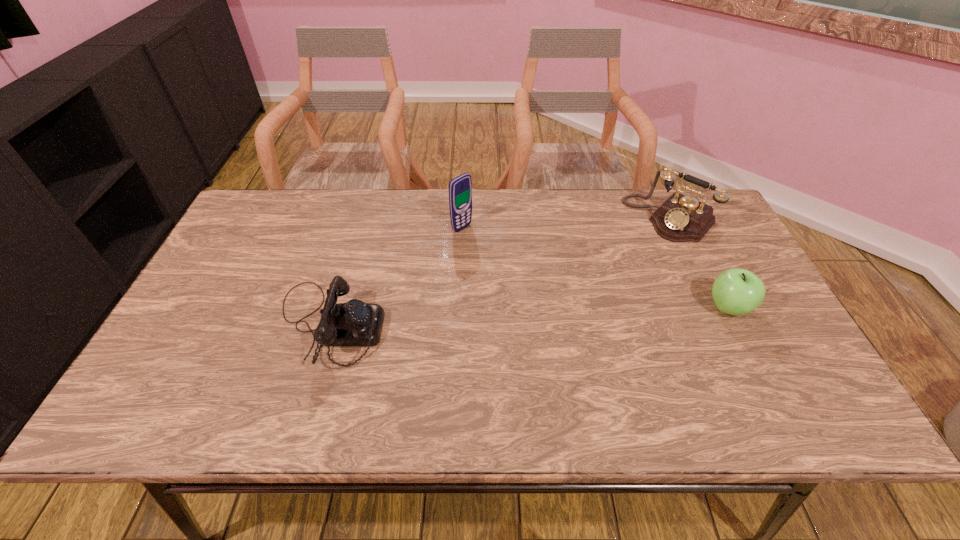
Find the location of `vacant space located 0.250m on the front-facing side of the cellular telephone`. vacant space located 0.250m on the front-facing side of the cellular telephone is located at coordinates (532, 275).

Where is `vacant area situated 0.220m on the dial of the taller telephone`? The width and height of the screenshot is (960, 540). vacant area situated 0.220m on the dial of the taller telephone is located at coordinates (610, 275).

Image resolution: width=960 pixels, height=540 pixels. Identify the location of vacant space located 0.090m on the dial of the taller telephone. (634, 251).

Identify the location of vacant space located 0.270m on the dial of the taller telephone. This screenshot has height=540, width=960. (600, 285).

The image size is (960, 540). I want to click on cellular telephone present at the far edge, so click(460, 188).

Locate an element on the screen. This screenshot has height=540, width=960. telephone at the far edge is located at coordinates (680, 218).

Locate an element on the screen. object positioned at the near edge is located at coordinates (354, 323).

The image size is (960, 540). Identify the location of apple positioned at the right edge. (736, 291).

The width and height of the screenshot is (960, 540). Find the location of `telephone positioned at the right edge`. telephone positioned at the right edge is located at coordinates (680, 218).

This screenshot has width=960, height=540. Find the location of `object located in the far right corner section of the desktop`. object located in the far right corner section of the desktop is located at coordinates (680, 218).